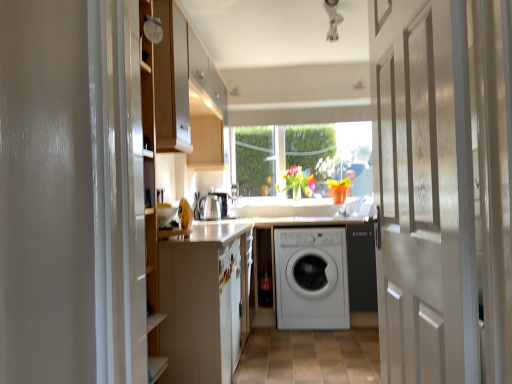
This screenshot has width=512, height=384. Find the location of `white matte exhaust hood at center`. white matte exhaust hood at center is located at coordinates (300, 112).

What is the approximate height of white matte washing machine at center?

It is 91.39 centimeters.

Find the location of `vibrant glass vase at center`. vibrant glass vase at center is located at coordinates (298, 181).

You are a GUI agent. You are given a task and a screenshot of the screen. Output one action in this format:
    pyautogui.click(x=<x>, y=<y>)
    Task: Click on the white glossy door at center
    This screenshot has height=384, width=512.
    Given the screenshot: What is the action you would take?
    (425, 195)

Would you say white matte washing machine at center is part of white matte cabinet at left's contents?

No.

Based on the photo, is white matte cabinet at left next to white matte washing machine at center and touching it?

No, white matte cabinet at left is not touching white matte washing machine at center.

Which is behind, white matte cabinet at left or white matte washing machine at center?

white matte washing machine at center.

Which of these two, white glossy door at center or white matte cabinet at left, is smaller?

white glossy door at center is smaller.

Is white glossy door at center completely or partially outside of white matte cabinet at left?

Indeed, white glossy door at center is completely outside white matte cabinet at left.

Could you tell me if white matte cabinet at left is turned towards satin silver kettle at center?

No.

From a real-world perspective, which is physically above, white matte cabinet at left or satin silver kettle at center?

satin silver kettle at center is physically above.

How different are the orientations of white matte cabinet at left and satin silver kettle at center in degrees?

The facing directions of white matte cabinet at left and satin silver kettle at center are 1.25 degrees apart.

Where is `appliance located above the white matte cabinet at left (from a real-world perspective)`? This screenshot has height=384, width=512. appliance located above the white matte cabinet at left (from a real-world perspective) is located at coordinates (213, 206).

Does white glossy door at center turn towards vibrant glass vase at center?

No.

Considering the sizes of white glossy door at center and vibrant glass vase at center in the image, is white glossy door at center wider or thinner than vibrant glass vase at center?

Clearly, white glossy door at center has less width compared to vibrant glass vase at center.

Which is nearer, (439,138) or (295,194)?

The point (439,138) is more forward.

Which object is positioned more to the left, white glossy door at center or vibrant glass vase at center?

vibrant glass vase at center is more to the left.

At what (x,y) coordinates should I click in order to perform the action: click on window that is below the white matte exhaust hood at center (from the image's perspective). Please return your answer as a coordinate pair (x, y). The image size is (512, 384). Looking at the image, I should click on tap(296, 148).

Which is behind, white matte exhaust hood at center or clear glass window at center?

clear glass window at center.

Is white matte exhaust hood at center to the right of clear glass window at center from the viewer's perspective?

In fact, white matte exhaust hood at center is to the left of clear glass window at center.

From a real-world perspective, is white matte exhaust hood at center over clear glass window at center?

Yes, from a real-world perspective, white matte exhaust hood at center is above clear glass window at center.

Choose the correct answer: Is white glossy door at center inside clear glass window at center or outside it?

white glossy door at center is not enclosed by clear glass window at center.

Between white glossy door at center and clear glass window at center, which one appears on the right side from the viewer's perspective?

clear glass window at center is more to the right.

Can you confirm if satin silver kettle at center is positioned to the right of clear glass window at center?

In fact, satin silver kettle at center is to the left of clear glass window at center.

Considering the relative sizes of satin silver kettle at center and clear glass window at center in the image provided, is satin silver kettle at center bigger than clear glass window at center?

No, satin silver kettle at center is not bigger than clear glass window at center.

Locate an element on the screen. cabinetry in front of the white matte washing machine at center is located at coordinates (204, 302).

Locate an element on the screen. This screenshot has height=384, width=512. cabinetry below the white glossy door at center (from the image's perspective) is located at coordinates (204, 302).

Based on their spatial positions, is clear glass window at center or white matte washing machine at center closer to white matte cabinet at left?

Among the two, white matte washing machine at center is located nearer to white matte cabinet at left.

Based on their spatial positions, is vibrant glass vase at center or satin silver kettle at center closer to white matte exhaust hood at center?

vibrant glass vase at center lies closer to white matte exhaust hood at center than the other object.

Estimate the real-world distances between objects in this image. Which object is closer to clear glass window at center, white glossy door at center or white matte washing machine at center?

white matte washing machine at center is positioned closer to the anchor clear glass window at center.

Estimate the real-world distances between objects in this image. Which object is closer to white glossy door at center, satin silver kettle at center or clear glass window at center?

Based on the image, satin silver kettle at center appears to be nearer to white glossy door at center.

From the picture: Which object lies further to the anchor point white matte exhaust hood at center, white matte cabinet at left or white glossy door at center?

Among the two, white glossy door at center is located further to white matte exhaust hood at center.

Considering their positions, is vibrant glass vase at center positioned closer to satin silver kettle at center than clear glass window at center?

Based on the image, vibrant glass vase at center appears to be nearer to satin silver kettle at center.

Based on their spatial positions, is white glossy door at center or vibrant glass vase at center further from clear glass window at center?

The object further to clear glass window at center is white glossy door at center.

Based on their spatial positions, is satin silver kettle at center or clear glass window at center closer to vibrant glass vase at center?

clear glass window at center.

Where is `appliance located between white glossy door at center and white matte exhaust hood at center in the depth direction`? appliance located between white glossy door at center and white matte exhaust hood at center in the depth direction is located at coordinates (213, 206).

This screenshot has height=384, width=512. I want to click on appliance between white matte exhaust hood at center and white matte washing machine at center vertically, so click(x=213, y=206).

I want to click on window between white matte exhaust hood at center and white matte washing machine at center vertically, so [x=296, y=148].

I want to click on appliance between clear glass window at center and white matte washing machine at center in the up-down direction, so click(x=213, y=206).